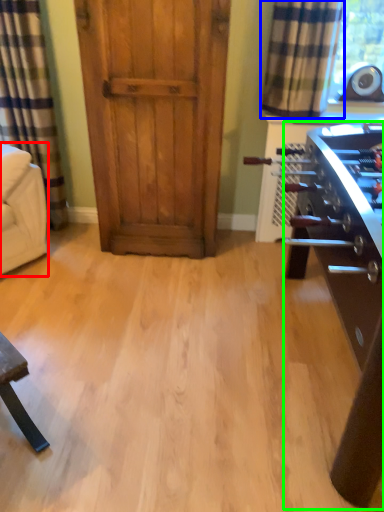
Question: Which is nearer to the armchair (highlighted by a red box)? curtain (highlighted by a blue box) or table (highlighted by a green box).

Choices:
 (A) curtain
 (B) table

Answer: (A)